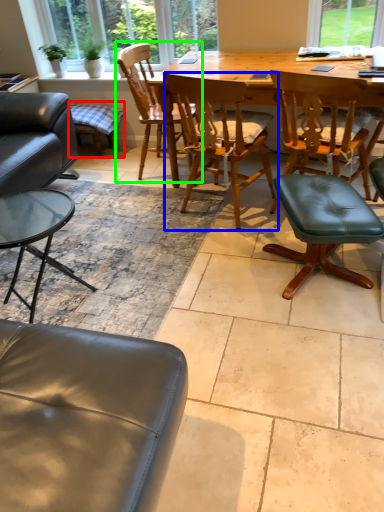
Question: Considering the real-world distances, which object is closest to bar stool (highlighted by a red box)? chair (highlighted by a blue box) or chair (highlighted by a green box).

Choices:
 (A) chair
 (B) chair

Answer: (B)